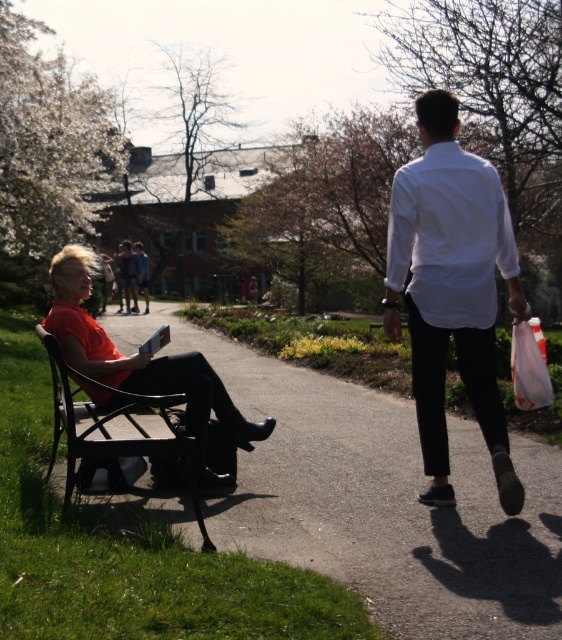
Which is below, white smooth shirt at right or black metal bench at left?

black metal bench at left

You are a GUI agent. You are given a task and a screenshot of the screen. Output one action in this format:
    pyautogui.click(x=<x>, y=<y>)
    Task: Click on the white smooth shirt at right
    The image size is (562, 640).
    Given the screenshot: What is the action you would take?
    pyautogui.click(x=451, y=289)

This screenshot has width=562, height=640. I want to click on white smooth shirt at right, so click(x=451, y=289).

What do you see at coordinates (378, 497) in the screenshot? The width and height of the screenshot is (562, 640). I see `wooden bench at left` at bounding box center [378, 497].

Which is more to the left, wooden bench at left or white smooth shirt at right?

wooden bench at left is more to the left.

Does point (301, 456) come farther from viewer compared to point (432, 196)?

Yes, point (301, 456) is behind point (432, 196).

You are a GUI agent. You are given a task and a screenshot of the screen. Output one action in this format:
    pyautogui.click(x=<x>, y=<y>)
    Task: Click on the wooden bench at left
    
    Given the screenshot: What is the action you would take?
    pyautogui.click(x=378, y=497)

Is wooden bench at left to the right of matte orange shirt at left from the viewer's perspective?

Correct, you'll find wooden bench at left to the right of matte orange shirt at left.

Is point (294, 483) closer to viewer compared to point (60, 296)?

No, (294, 483) is behind (60, 296).

This screenshot has height=640, width=562. I want to click on wooden bench at left, so click(378, 497).

At what (x,y) coordinates should I click in order to perform the action: click on wooden bench at left. Please return your answer as a coordinate pair (x, y). Looking at the image, I should click on (378, 497).